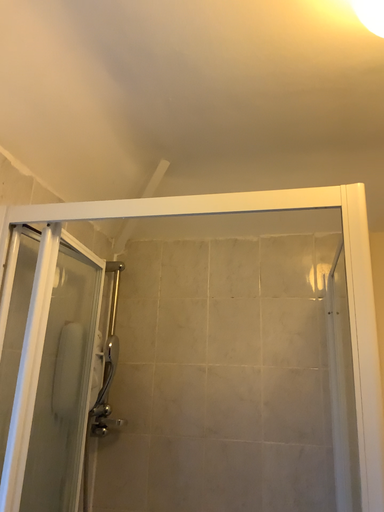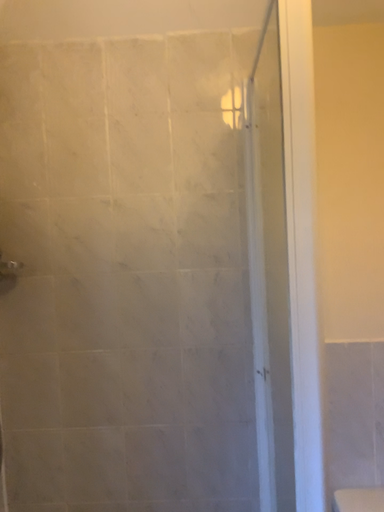
Question: Which way did the camera rotate in the video?

Choices:
 (A) rotated left
 (B) rotated right

Answer: (B)